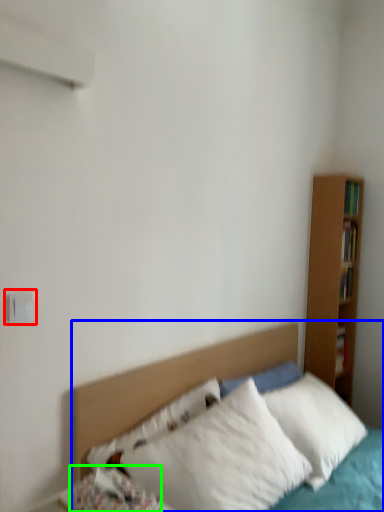
Question: Which object is the farthest from electric outlet (highlighted by a red box)? Choose among these: bed (highlighted by a blue box) or pillow (highlighted by a green box).

Choices:
 (A) bed
 (B) pillow

Answer: (A)